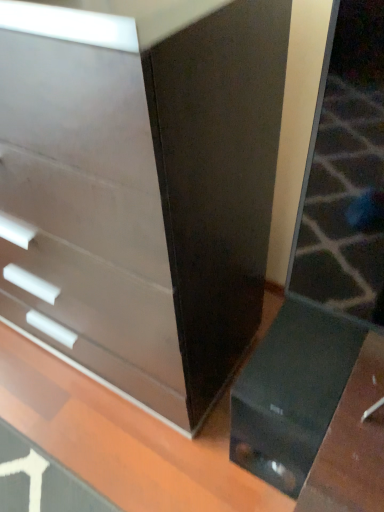
Find the location of a particular element. The image size is (384, 512). glossy black table at lower right is located at coordinates (184, 440).

What do you see at coordinates (184, 440) in the screenshot?
I see `glossy black table at lower right` at bounding box center [184, 440].

Describe the element at coordinates (141, 191) in the screenshot. Image resolution: width=384 pixels, height=512 pixels. I see `matte white chest of drawers at left` at that location.

Where is `matte white chest of drawers at left`? The height and width of the screenshot is (512, 384). matte white chest of drawers at left is located at coordinates (141, 191).

What is the approximate height of matte white chest of drawers at left?

matte white chest of drawers at left is 39.25 inches tall.

I want to click on glossy black table at lower right, so click(184, 440).

In the image, is matte white chest of drawers at left on the left side or the right side of glossy black table at lower right?

Clearly, matte white chest of drawers at left is on the left of glossy black table at lower right in the image.

Which object is further away from the camera taking this photo, matte white chest of drawers at left or glossy black table at lower right?

matte white chest of drawers at left is further from the camera.

Does point (219, 270) appear closer or farther from the camera than point (32, 439)?

Point (219, 270) is positioned closer to the camera compared to point (32, 439).

From the image's perspective, is matte white chest of drawers at left located above glossy black table at lower right?

Indeed, from the image's perspective, matte white chest of drawers at left is shown above glossy black table at lower right.

From a real-world perspective, which object stands above the other?

From a 3D spatial view, matte white chest of drawers at left is above.

Can you confirm if matte white chest of drawers at left is wider than glossy black table at lower right?

Incorrect, the width of matte white chest of drawers at left does not surpass that of glossy black table at lower right.

Who is taller, matte white chest of drawers at left or glossy black table at lower right?

matte white chest of drawers at left is taller.

Is matte white chest of drawers at left smaller than glossy black table at lower right?

No, matte white chest of drawers at left is not smaller than glossy black table at lower right.

Is matte white chest of drawers at left located outside glossy black table at lower right?

Yes, matte white chest of drawers at left is outside of glossy black table at lower right.

Is there a large distance between matte white chest of drawers at left and glossy black table at lower right?

No, matte white chest of drawers at left is in close proximity to glossy black table at lower right.

In the scene shown: Is matte white chest of drawers at left aimed at glossy black table at lower right?

No, matte white chest of drawers at left is not facing towards glossy black table at lower right.

Where is `table that appears in front of the matte white chest of drawers at left`? The width and height of the screenshot is (384, 512). table that appears in front of the matte white chest of drawers at left is located at coordinates (184, 440).

From the picture: Does glossy black table at lower right appear on the left side of matte white chest of drawers at left?

Incorrect, glossy black table at lower right is not on the left side of matte white chest of drawers at left.

Which is in front, glossy black table at lower right or matte white chest of drawers at left?

glossy black table at lower right is in front.

Between point (343, 436) and point (127, 64), which one is positioned in front?

Positioned in front is point (127, 64).

From the image's perspective, is glossy black table at lower right below matte white chest of drawers at left?

Yes, from the image's perspective, glossy black table at lower right is beneath matte white chest of drawers at left.

From a real-world perspective, which object stands above the other?

matte white chest of drawers at left, from a real-world perspective.

Which object is thinner, glossy black table at lower right or matte white chest of drawers at left?

With smaller width is matte white chest of drawers at left.

Considering the sizes of objects glossy black table at lower right and matte white chest of drawers at left in the image provided, who is taller, glossy black table at lower right or matte white chest of drawers at left?

With more height is matte white chest of drawers at left.

Considering the relative sizes of glossy black table at lower right and matte white chest of drawers at left in the image provided, is glossy black table at lower right bigger than matte white chest of drawers at left?

No, glossy black table at lower right is not bigger than matte white chest of drawers at left.

Is glossy black table at lower right inside the boundaries of matte white chest of drawers at left, or outside?

glossy black table at lower right is not inside matte white chest of drawers at left, it's outside.

Does glossy black table at lower right touch matte white chest of drawers at left?

glossy black table at lower right is not next to matte white chest of drawers at left, and they're not touching.

Is glossy black table at lower right looking in the opposite direction of matte white chest of drawers at left?

No, matte white chest of drawers at left is not at the back of glossy black table at lower right.

At what (x,y) coordinates should I click in order to perform the action: click on table that appears on the right of matte white chest of drawers at left. Please return your answer as a coordinate pair (x, y). The width and height of the screenshot is (384, 512). Looking at the image, I should click on (184, 440).

In order to click on table below the matte white chest of drawers at left (from the image's perspective) in this screenshot , I will do `click(184, 440)`.

In the image, there is a matte white chest of drawers at left. Where is `table below it (from a real-world perspective)`? This screenshot has width=384, height=512. table below it (from a real-world perspective) is located at coordinates (184, 440).